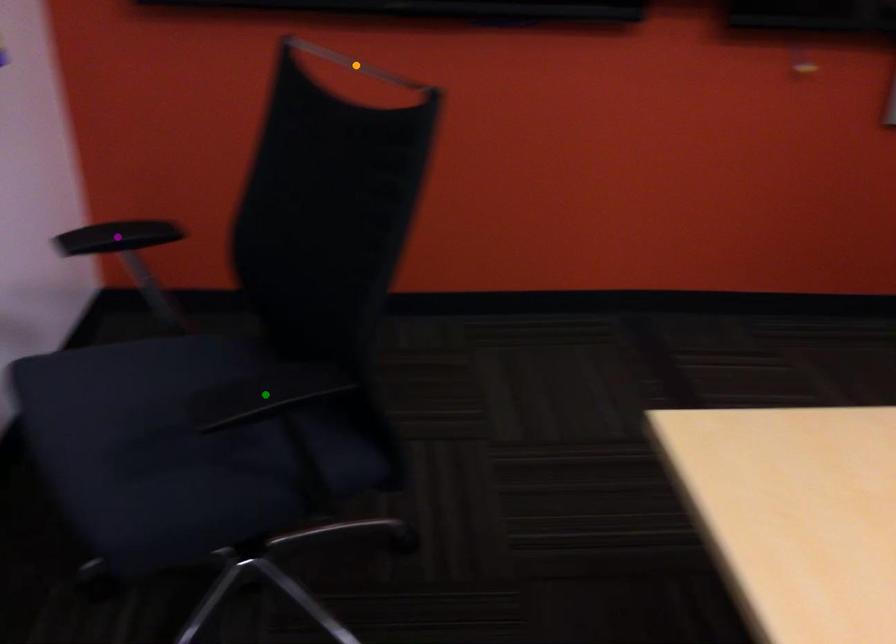
Order these from farthest to nearest:
purple point, orange point, green point

orange point
purple point
green point